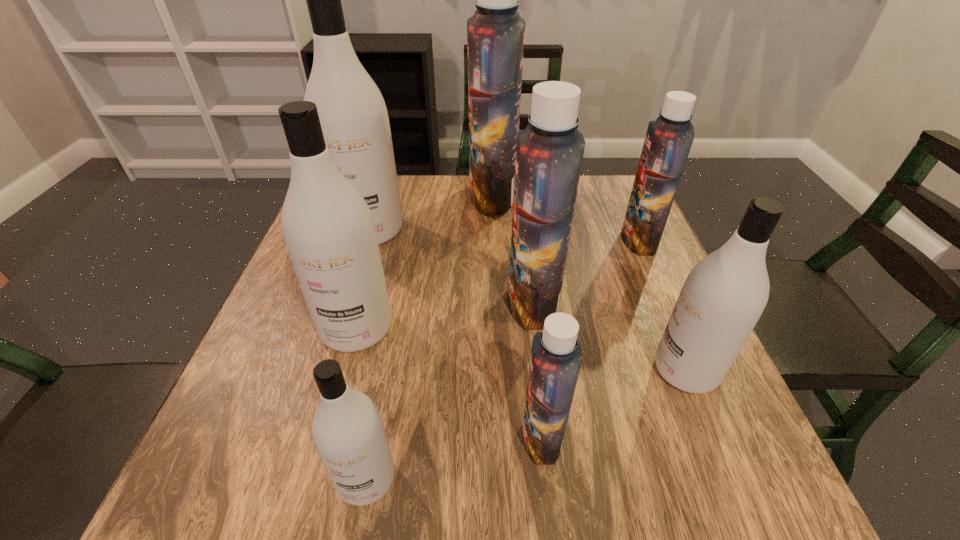
Locate an element on the screen. free location at the near left corner is located at coordinates (275, 472).

I want to click on free point at the far right corner, so click(x=579, y=197).

You are a GUI agent. You are given a task and a screenshot of the screen. Output one action in this format:
    pyautogui.click(x=<x>, y=<y>)
    Task: Click on the blank region between the rightmost blue shampoo and the rightmost white shampoo
    The image size is (960, 540).
    Given the screenshot: What is the action you would take?
    pyautogui.click(x=662, y=305)

Where is `vacant region between the second biggest white shampoo and the smallest blue shampoo`? The width and height of the screenshot is (960, 540). vacant region between the second biggest white shampoo and the smallest blue shampoo is located at coordinates (449, 382).

Where is `free space between the rightmost white shampoo and the nearest blue shampoo`? free space between the rightmost white shampoo and the nearest blue shampoo is located at coordinates (613, 403).

This screenshot has height=540, width=960. I want to click on free spot between the third smallest white shampoo and the nearest blue shampoo, so click(x=449, y=382).

Find the location of a particular element. free spot between the third smallest white shampoo and the smallest blue shampoo is located at coordinates (449, 382).

You are a GUI agent. You are given a task and a screenshot of the screen. Output one action in this format:
    pyautogui.click(x=<x>, y=<y>)
    Task: Click on the unoccupied area between the third farthest blue shampoo and the rightmost white shampoo
    This screenshot has height=540, width=960.
    Given the screenshot: What is the action you would take?
    pyautogui.click(x=610, y=336)

Locate an element on the screen. Image resolution: width=960 pixels, height=540 pixels. free spot between the smallest blue shampoo and the second smallest white shampoo is located at coordinates (613, 403).

Where is `free point between the rightmost white shampoo and the second biggest white shampoo`? free point between the rightmost white shampoo and the second biggest white shampoo is located at coordinates (521, 349).